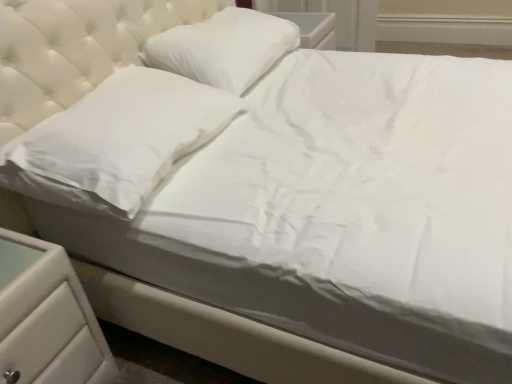
Question: From a real-world perspective, is white smooth pillow at left, which appears as the second pillow when viewed from the back, positioned above or below white plastic drawer at lower left?

Choices:
 (A) below
 (B) above

Answer: (B)

Question: Does point (108, 77) appear closer or farther from the camera than point (15, 380)?

Choices:
 (A) closer
 (B) farther

Answer: (B)

Question: Which of these objects is positioned farthest from the white plastic drawer at lower left?

Choices:
 (A) white smooth pillow at left, which appears as the second pillow when viewed from the back
 (B) white smooth pillow at upper center, the 2th pillow from the front

Answer: (B)

Question: Considering the real-world distances, which object is closest to the white plastic drawer at lower left?

Choices:
 (A) white smooth pillow at left, which is the first pillow in front-to-back order
 (B) white smooth pillow at upper center, positioned as the first pillow in back-to-front order

Answer: (A)